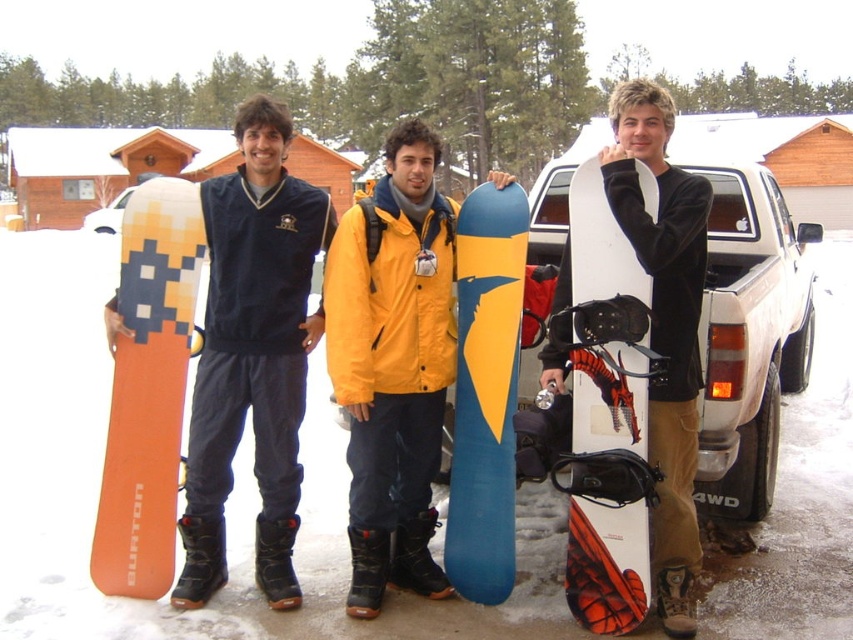
This screenshot has height=640, width=853. What do you see at coordinates (393, 364) in the screenshot?
I see `yellow matte snowboard at center` at bounding box center [393, 364].

Is point (434, 392) behind point (576, 433)?

That is True.

Is point (376, 563) less distant than point (579, 499)?

No, (376, 563) is behind (579, 499).

Locate an element on the screen. The width and height of the screenshot is (853, 640). yellow matte snowboard at center is located at coordinates (393, 364).

Does matte orange snowboard at left have a lesser width compared to white matte snowboard at right?

No, matte orange snowboard at left is not thinner than white matte snowboard at right.

Between point (212, 250) and point (589, 529), which one is positioned in front?

Point (589, 529) is more forward.

Who is more distant from viewer, [259,141] or [657,198]?

Positioned behind is point [259,141].

Identify the location of matte orange snowboard at left. (253, 353).

Is yellow matte snowboard at center thinner than matte orange snowboard at left?

Correct, yellow matte snowboard at center's width is less than matte orange snowboard at left's.

Identify the location of yellow matte snowboard at center. Image resolution: width=853 pixels, height=640 pixels. (393, 364).

Measure the distance between point (347, 538) and camera.

A distance of 3.77 meters exists between point (347, 538) and camera.

What are the coordinates of `yellow matte snowboard at center` in the screenshot? It's located at coord(393,364).